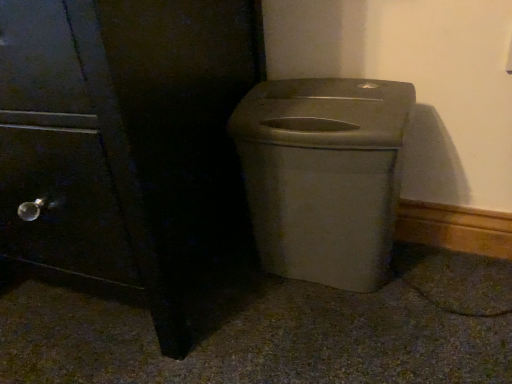
Question: From a real-world perspective, is matte black side cabinet at left beneath matte plastic trash can at center?

Choices:
 (A) no
 (B) yes

Answer: (A)

Question: From a real-world perspective, is matte black side cabinet at left located higher than matte plastic trash can at center?

Choices:
 (A) no
 (B) yes

Answer: (B)

Question: Is matte black side cabinet at left next to matte plastic trash can at center?

Choices:
 (A) no
 (B) yes

Answer: (A)

Question: Is matte black side cabinet at left to the right of matte plastic trash can at center from the viewer's perspective?

Choices:
 (A) no
 (B) yes

Answer: (A)

Question: Considering the relative sizes of matte black side cabinet at left and matte plastic trash can at center in the image provided, is matte black side cabinet at left thinner than matte plastic trash can at center?

Choices:
 (A) no
 (B) yes

Answer: (A)

Question: Are matte black side cabinet at left and matte plastic trash can at center located far from each other?

Choices:
 (A) no
 (B) yes

Answer: (A)

Question: From a real-world perspective, is matte plastic trash can at center positioned over matte black side cabinet at left based on gravity?

Choices:
 (A) yes
 (B) no

Answer: (B)

Question: Is matte plastic trash can at center not near matte black side cabinet at left?

Choices:
 (A) no
 (B) yes

Answer: (A)

Question: Is matte plastic trash can at center at the left side of matte black side cabinet at left?

Choices:
 (A) no
 (B) yes

Answer: (A)

Question: Would you say matte black side cabinet at left is part of matte plastic trash can at center's contents?

Choices:
 (A) yes
 (B) no

Answer: (B)

Question: Is matte plastic trash can at center facing away from matte black side cabinet at left?

Choices:
 (A) yes
 (B) no

Answer: (B)

Question: From a real-world perspective, does matte plastic trash can at center sit lower than matte black side cabinet at left?

Choices:
 (A) no
 (B) yes

Answer: (B)

Question: Is matte black side cabinet at left taller or shorter than matte plastic trash can at center?

Choices:
 (A) tall
 (B) short

Answer: (A)